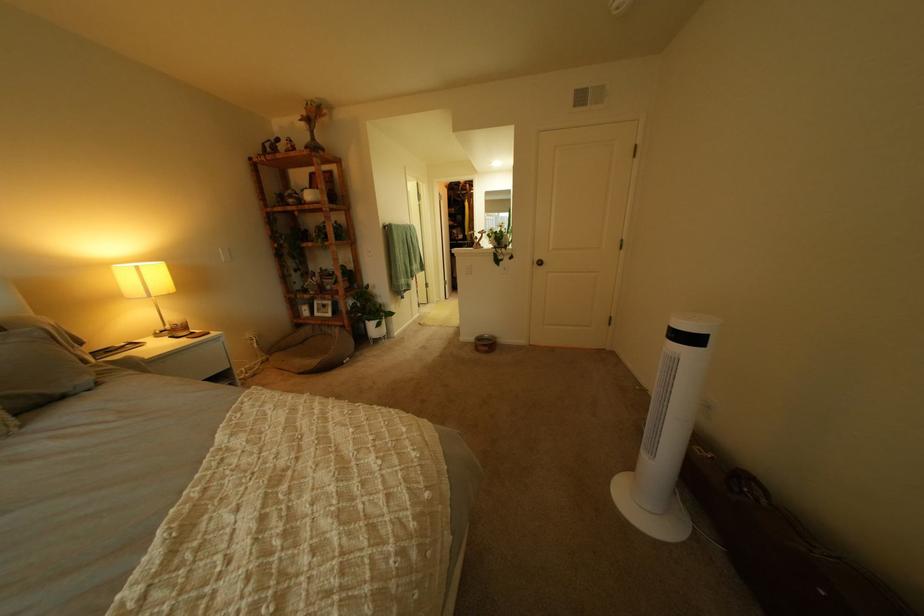
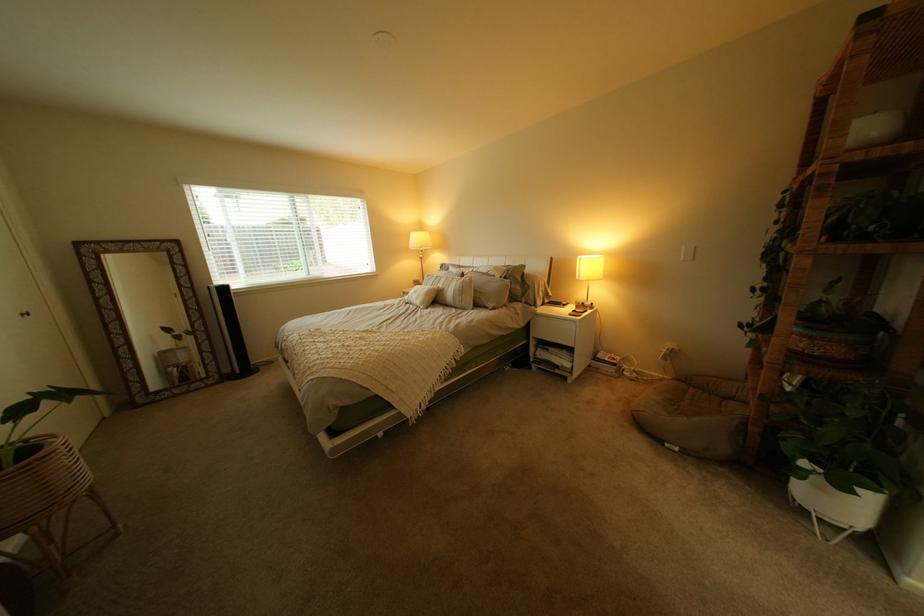
The point at (115, 385) is marked in the first image. Where is the corresponding point in the second image?

(509, 310)